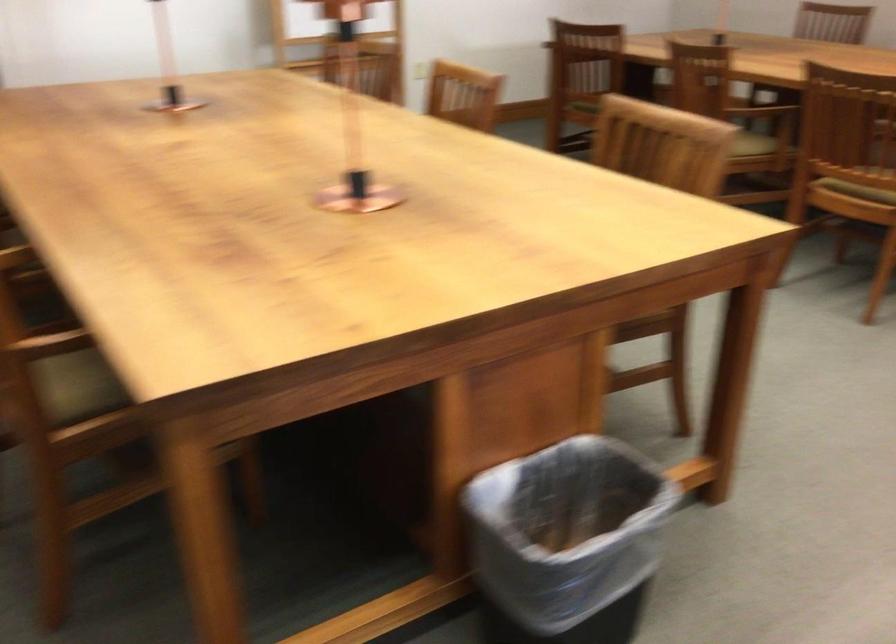
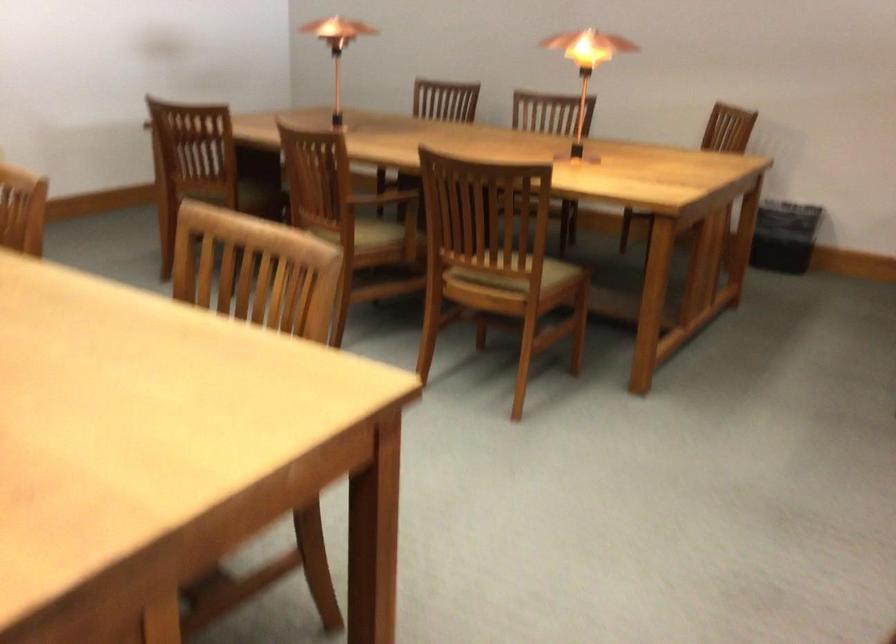
Question: The images are taken continuously from a first-person perspective. In which direction is your viewpoint rotating?

Choices:
 (A) Left
 (B) Right
 (C) Up
 (D) Down

Answer: (B)